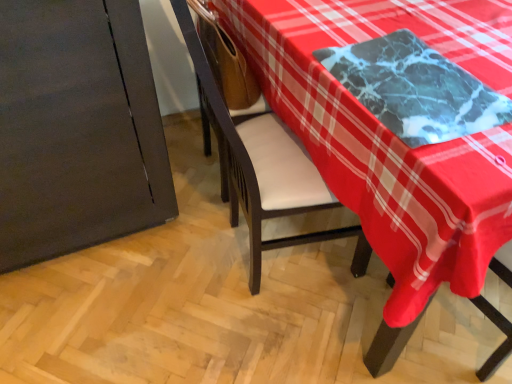
Question: Is marble table at upper right smaller than marble-like black tray at upper right?

Choices:
 (A) yes
 (B) no

Answer: (B)

Question: From the image's perspective, is marble table at upper right on marble-like black tray at upper right?

Choices:
 (A) no
 (B) yes

Answer: (A)

Question: Is marble table at upper right oriented towards marble-like black tray at upper right?

Choices:
 (A) no
 (B) yes

Answer: (A)

Question: Does marble table at upper right have a greater height compared to marble-like black tray at upper right?

Choices:
 (A) no
 (B) yes

Answer: (B)

Question: Is marble table at upper right located outside marble-like black tray at upper right?

Choices:
 (A) no
 (B) yes

Answer: (B)

Question: Considering the positions of point (417, 112) and point (455, 190), is point (417, 112) closer or farther from the camera than point (455, 190)?

Choices:
 (A) farther
 (B) closer

Answer: (A)

Question: Is marble-like black tray at upper right taller or shorter than marble table at upper right?

Choices:
 (A) tall
 (B) short

Answer: (B)

Question: Looking at their shapes, would you say marble-like black tray at upper right is wider or thinner than marble table at upper right?

Choices:
 (A) thin
 (B) wide

Answer: (A)

Question: From the image's perspective, is marble-like black tray at upper right positioned above or below marble table at upper right?

Choices:
 (A) above
 (B) below

Answer: (A)

Question: Considering the positions of marble table at upper right and marble-like black tray at upper right in the image, is marble table at upper right wider or thinner than marble-like black tray at upper right?

Choices:
 (A) wide
 (B) thin

Answer: (A)

Question: Is point (288, 39) closer or farther from the camera than point (344, 51)?

Choices:
 (A) farther
 (B) closer

Answer: (A)

Question: From the image's perspective, is marble table at upper right located above or below marble-like black tray at upper right?

Choices:
 (A) above
 (B) below

Answer: (B)

Question: In the image, is marble table at upper right positioned in front of or behind marble-like black tray at upper right?

Choices:
 (A) front
 (B) behind

Answer: (B)

Question: In terms of size, does wooden armchair at center appear bigger or smaller than marble table at upper right?

Choices:
 (A) big
 (B) small

Answer: (B)

Question: From the image's perspective, is wooden armchair at center above or below marble table at upper right?

Choices:
 (A) above
 (B) below

Answer: (A)